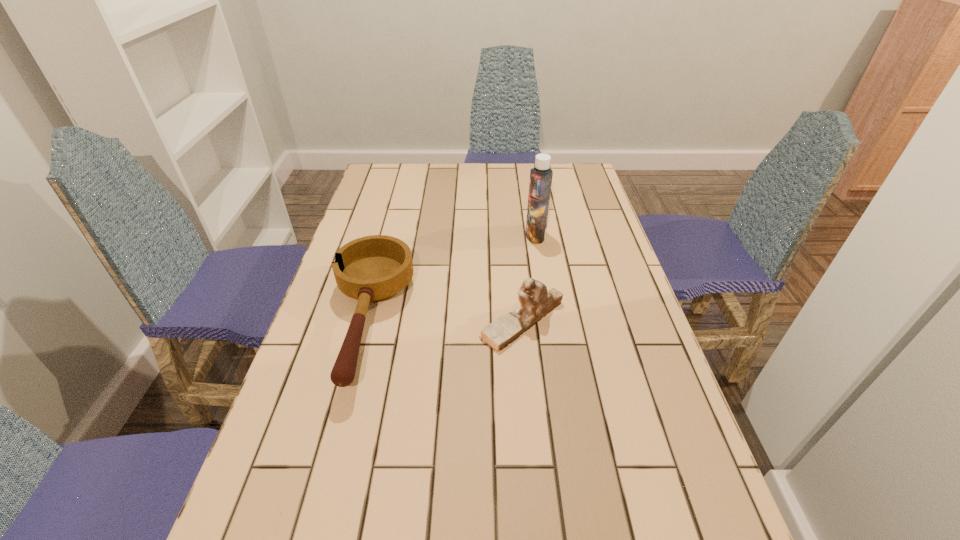
The height and width of the screenshot is (540, 960). What are the coordinates of `blank region between the shampoo and the figurine` in the screenshot? It's located at (529, 278).

Identify the location of free point between the saucepan and the tallest object. (452, 278).

Identify the location of vacant point located between the farthest object and the leftmost object. (452, 278).

I want to click on unoccupied area between the figurine and the shortest object, so point(445,321).

The image size is (960, 540). Find the location of `free space between the shampoo and the leftmost object`. free space between the shampoo and the leftmost object is located at coordinates (452, 278).

Identify which object is the closest to the farthest object. Please provide its 2D coordinates. Your answer should be formatted as a tuple, i.e. [(x, y)], where the tuple contains the x and y coordinates of a point satisfying the conditions above.

[(536, 301)]

Identify which object is the closest to the tallest object. Please provide its 2D coordinates. Your answer should be formatted as a tuple, i.e. [(x, y)], where the tuple contains the x and y coordinates of a point satisfying the conditions above.

[(536, 301)]

Where is `free spot that satisfies the following two spatial constraints: 1. on the front-facing side of the second shortest object; 2. with the handle on the side of the saucepan`? free spot that satisfies the following two spatial constraints: 1. on the front-facing side of the second shortest object; 2. with the handle on the side of the saucepan is located at coordinates (522, 321).

The width and height of the screenshot is (960, 540). Identify the location of free region that satisfies the following two spatial constraints: 1. on the front label of the tallest object; 2. with the handle on the side of the shortest object. (549, 321).

Identify the location of blank area in the image that satisfies the following two spatial constraints: 1. on the front-facing side of the figurine; 2. with the handle on the side of the leftmost object. (522, 321).